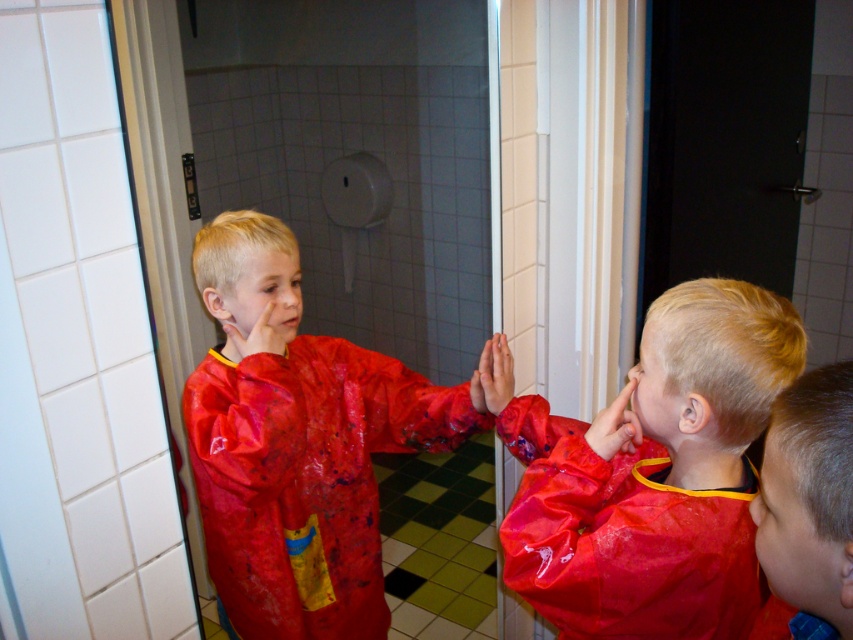
Is shiny red raincoat at right wider than shiny red raincoat at lower right?

Correct, the width of shiny red raincoat at right exceeds that of shiny red raincoat at lower right.

Is shiny red raincoat at right taller than shiny red raincoat at lower right?

Indeed, shiny red raincoat at right has a greater height compared to shiny red raincoat at lower right.

What are the coordinates of `shiny red raincoat at right` in the screenshot? It's located at (653, 474).

The height and width of the screenshot is (640, 853). Describe the element at coordinates (297, 444) in the screenshot. I see `shiny red raincoat at center` at that location.

Who is more forward, [276,332] or [786,404]?

Point [786,404] is in front.

Where is `shiny red raincoat at center`? shiny red raincoat at center is located at coordinates (297, 444).

Is point (689, 541) less distant than point (344, 614)?

Yes, it is.

Who is more forward, (752, 582) or (381, 598)?

Positioned in front is point (752, 582).

Image resolution: width=853 pixels, height=640 pixels. What are the coordinates of `shiny red raincoat at right` in the screenshot? It's located at (653, 474).